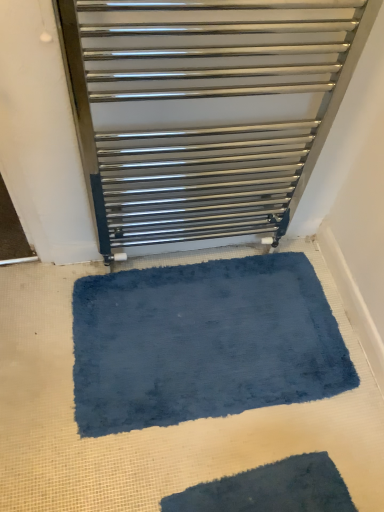
At what (x,y) coordinates should I click in order to perform the action: click on free point behind dark blue shaggy bath mat at lower center, positioned as the second bath mat in back-to-front order. Please return your answer as a coordinate pair (x, y). Looking at the image, I should click on (248, 393).